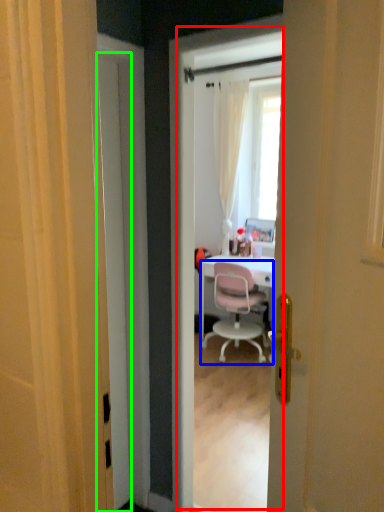
Question: Estimate the real-world distances between objects in this image. Which object is closer to screen door (highlighted by a red box), chair (highlighted by a blue box) or door (highlighted by a green box)?

Choices:
 (A) chair
 (B) door

Answer: (A)